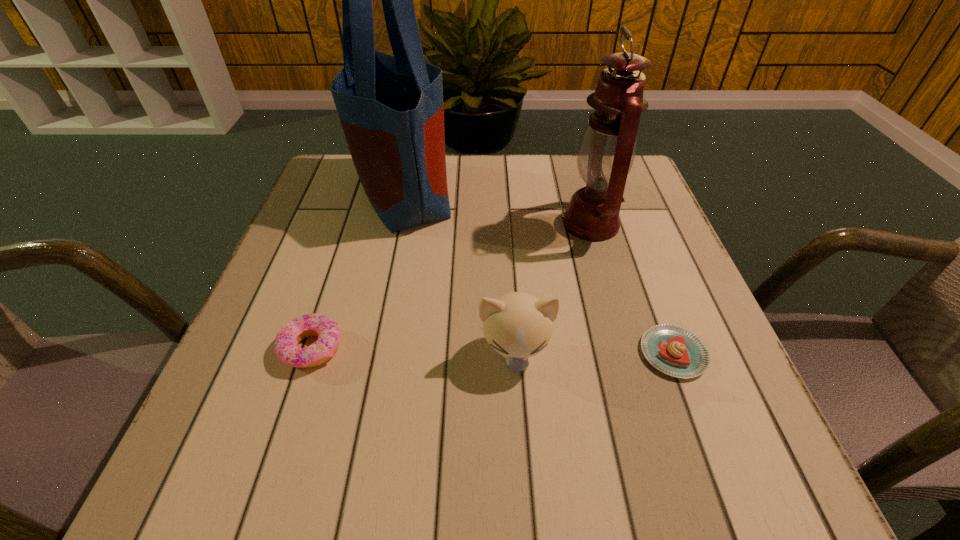
Where is `vacant region at the left edge`? This screenshot has height=540, width=960. vacant region at the left edge is located at coordinates (252, 335).

Find the location of a particular element. vacant region at the right edge is located at coordinates (637, 261).

Locate an element on the screen. The image size is (960, 540). free space at the near left corner is located at coordinates (226, 437).

Identify the location of free space at the far right corner of the desktop. (636, 174).

This screenshot has height=540, width=960. I want to click on free point between the second shortest object and the kitten, so click(x=413, y=351).

Find the location of a particular element. The width and height of the screenshot is (960, 540). vacant area that lies between the oil lamp and the pastry is located at coordinates (632, 288).

This screenshot has height=540, width=960. What are the coordinates of `free space between the second shortest object and the kitten` in the screenshot? It's located at (413, 351).

The image size is (960, 540). Identify the location of free spot between the second shortest object and the third object from right to left. (413, 351).

What are the coordinates of `vacant space in between the oil lamp and the kitten` in the screenshot? It's located at (553, 288).

I want to click on vacant space that's between the second shortest object and the handbag, so click(358, 271).